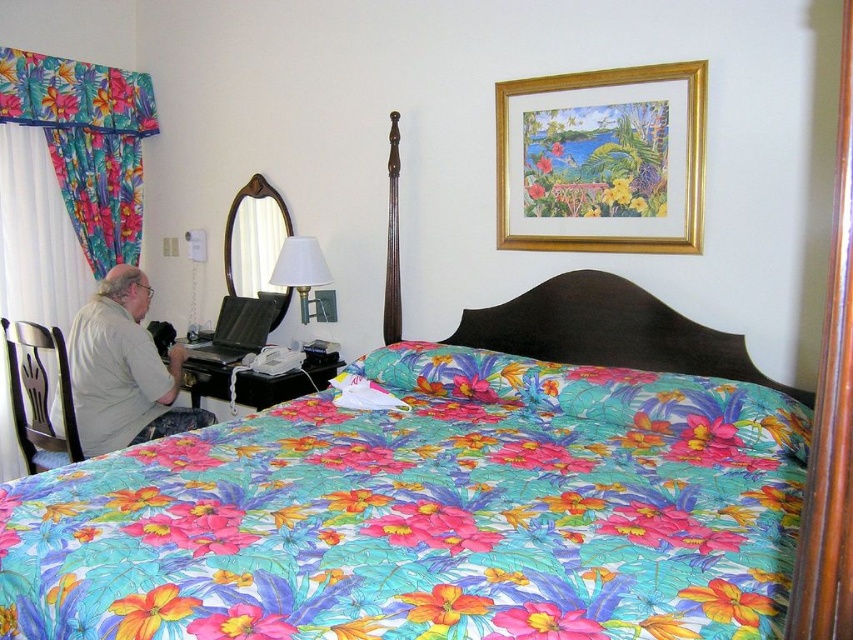
Which is in front, point (96, 353) or point (312, 240)?

Point (96, 353) is more forward.

Is point (113, 291) positioned before point (309, 250)?

Yes, point (113, 291) is closer to viewer.

This screenshot has width=853, height=640. I want to click on gray cotton shirt at left, so click(123, 369).

Does gold-framed painting at upper center lie in front of gray cotton shirt at left?

Yes, it is.

Who is more forward, (543,248) or (148,360)?

Point (543,248) is more forward.

Who is more distant from viewer, (535,156) or (86,452)?

The point (535,156) is more distant.

At what (x,y) coordinates should I click in order to perform the action: click on gold-framed painting at upper center. Please return your answer as a coordinate pair (x, y). This screenshot has width=853, height=640. Looking at the image, I should click on (602, 161).

Does gold-framed painting at upper center appear on the right side of floral fabric curtain at left?

Yes, gold-framed painting at upper center is to the right of floral fabric curtain at left.

Which is above, gold-framed painting at upper center or floral fabric curtain at left?

floral fabric curtain at left is above.

Which is behind, point (645, 237) or point (51, 84)?

The point (51, 84) is more distant.

The width and height of the screenshot is (853, 640). In order to click on gold-framed painting at upper center in this screenshot , I will do `click(602, 161)`.